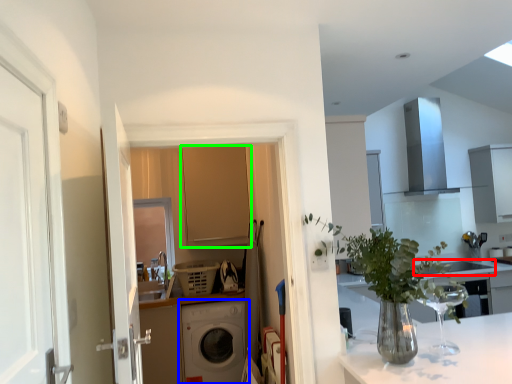
Question: Estimate the real-world distances between objects in this image. Which object is closer to sink (highlighted by a red box), washing machine (highlighted by a blue box) or cabinetry (highlighted by a green box)?

Choices:
 (A) washing machine
 (B) cabinetry

Answer: (A)